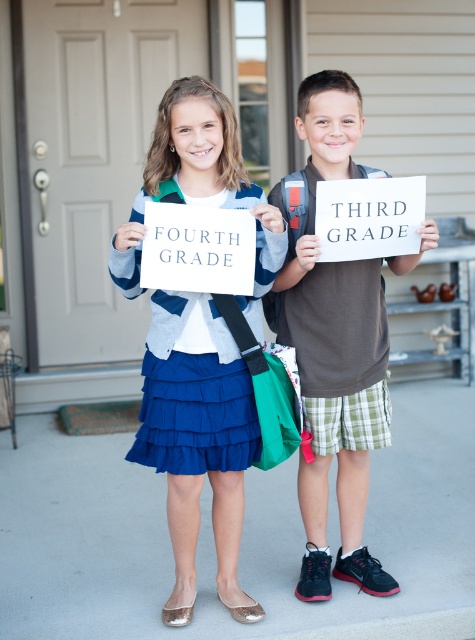
You are a photographer trying to capture a clear picture of both the blue fabric skirt at center and the brown cotton shirt at center. Since you want both items to be in focus, which one should you adjust your camera focus on first?

The blue fabric skirt at center is closer to the viewer than the brown cotton shirt at center, so you should focus on the blue fabric skirt at center first to ensure both are in focus.

You are a photographer taking a picture of the two children. You want to ensure that both the blue fabric skirt at center and the brown cotton shirt at center are clearly visible in the frame. Based on their positions, which clothing item is lower in the image?

The blue fabric skirt at center is positioned under the brown cotton shirt at center, so the blue fabric skirt at center is lower in the image.

What is the relationship in size between the blue fabric skirt at center and the brown cotton shirt at center?

The blue fabric skirt at center is smaller than the brown cotton shirt at center.